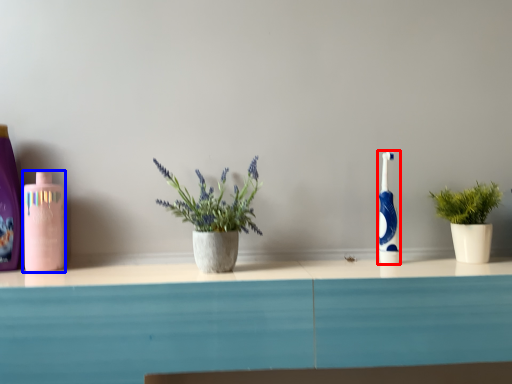
Question: Which object is closer to the camera taking this photo, toothbrush (highlighted by a red box) or mouthwash (highlighted by a blue box)?

Choices:
 (A) toothbrush
 (B) mouthwash

Answer: (B)